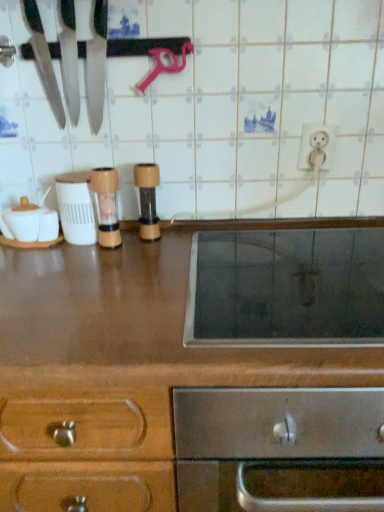
Question: In terms of height, does wooden pepper grinder at center, placed as the second appliance when sorted from right to left, look taller or shorter compared to white glossy electric outlet at upper right?

Choices:
 (A) tall
 (B) short

Answer: (A)

Question: In the image, is wooden pepper grinder at center, the second appliance in the left-to-right sequence, positioned in front of or behind white glossy electric outlet at upper right?

Choices:
 (A) front
 (B) behind

Answer: (A)

Question: Considering the real-world distances, which object is closest to the wooden pepper grinder at center, the second appliance in the left-to-right sequence?

Choices:
 (A) brown wood pepper grinder at center, the first appliance when ordered from right to left
 (B) shiny silver knife at upper left, which is counted as the 1th knife, starting from the right
 (C) white glossy electric outlet at upper right
 (D) shiny silver knife at upper left, acting as the first knife starting from the left
 (E) smooth glass cooktop at center

Answer: (A)

Question: Estimate the real-world distances between objects in this image. Which object is farther from the smooth glass cooktop at center?

Choices:
 (A) white glossy electric outlet at upper right
 (B) shiny silver knife at upper left, which ranks as the 2th knife in left-to-right order
 (C) wooden pepper grinder at center, placed as the second appliance when sorted from right to left
 (D) stainless steel oven at center
 (E) shiny silver knife at upper left, marked as the 2th knife in a right-to-left arrangement

Answer: (E)